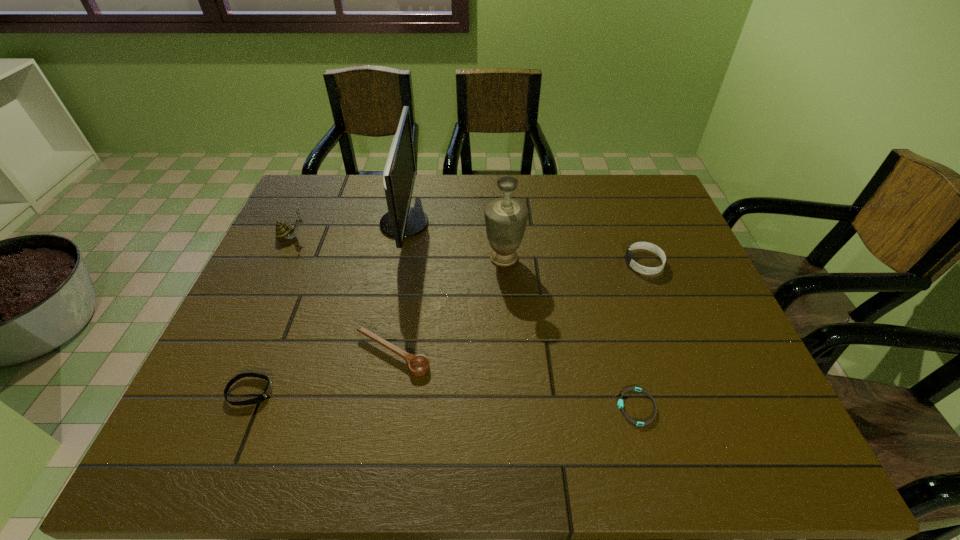
The image size is (960, 540). I want to click on monitor, so click(x=401, y=221).

At what (x,y) coordinates should I click in order to perform the action: click on the sixth shortest object. Please return your answer as a coordinate pair (x, y). This screenshot has height=540, width=960. Looking at the image, I should click on (505, 218).

Locate an element on the screen. the fifth object from left to right is located at coordinates [x=505, y=218].

This screenshot has width=960, height=540. Identify the location of snail. (283, 230).

What are the coordinates of `the rightmost wristband` in the screenshot? It's located at (629, 257).

The image size is (960, 540). Find the location of `the rightmost object`. the rightmost object is located at coordinates (629, 257).

Where is `the third shortest object`? This screenshot has width=960, height=540. the third shortest object is located at coordinates (418, 365).

Locate an element on the screen. The height and width of the screenshot is (540, 960). the fifth farthest object is located at coordinates (418, 365).

The image size is (960, 540). I want to click on the second shortest object, so click(x=268, y=389).

In order to click on the second shortest wristband in this screenshot , I will do `click(268, 389)`.